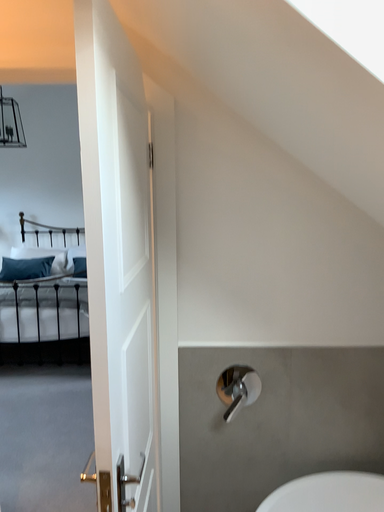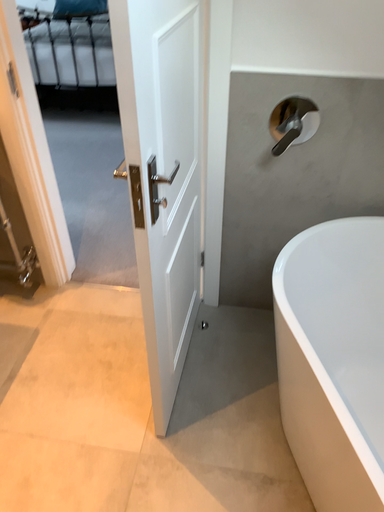
Question: How did the camera likely rotate when shooting the video?

Choices:
 (A) rotated left
 (B) rotated right

Answer: (A)